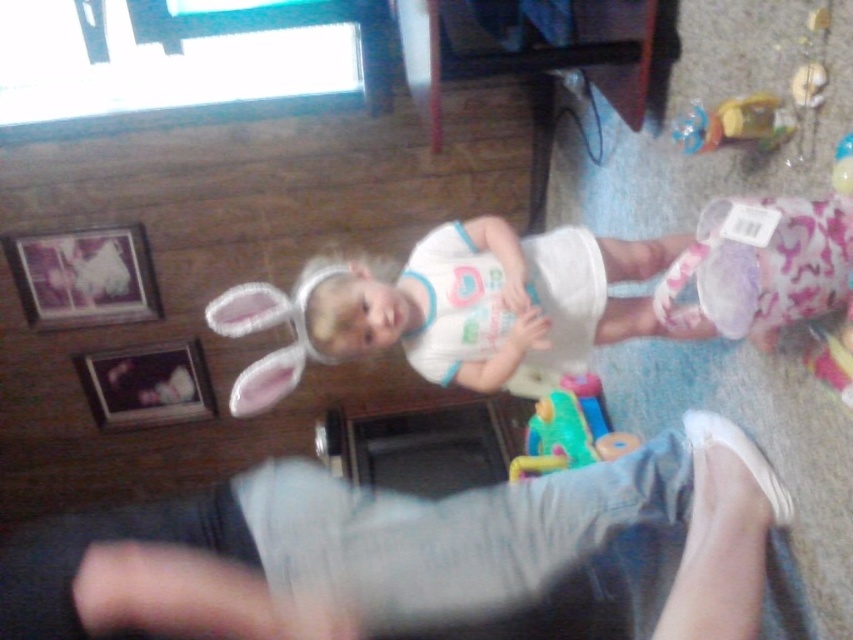
Does white fabric bunny ears at center appear under rubberized green toy at center?

No.

Which of these two, white fabric bunny ears at center or rubberized green toy at center, stands shorter?

rubberized green toy at center is shorter.

Between point (325, 323) and point (525, 442), which one is positioned in front?

Positioned in front is point (325, 323).

You are a GUI agent. You are given a task and a screenshot of the screen. Output one action in this format:
    pyautogui.click(x=<x>, y=<y>)
    Task: Click on the white fabric bunny ears at center
    
    Given the screenshot: What is the action you would take?
    pyautogui.click(x=450, y=307)

Is wooden picture frame at left in front of rubberized green toy at center?

No.

Between point (115, 388) and point (550, 392), which one is positioned in front?

Point (550, 392)

The width and height of the screenshot is (853, 640). I want to click on wooden picture frame at left, so click(146, 385).

Does metallic silver picture frame at upper left come in front of wooden picture frame at left?

Yes, it is.

Between point (51, 307) and point (163, 408), which one is positioned behind?

Point (163, 408)

Is point (3, 246) closer to camera compared to point (136, 400)?

Yes.

Locate an element on the screen. This screenshot has width=853, height=640. metallic silver picture frame at upper left is located at coordinates (83, 276).